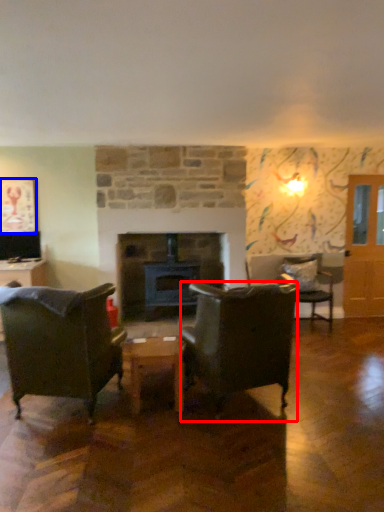
Question: Which of the following is the closest to the observer, chair (highlighted by a red box) or picture frame (highlighted by a blue box)?

Choices:
 (A) chair
 (B) picture frame

Answer: (A)